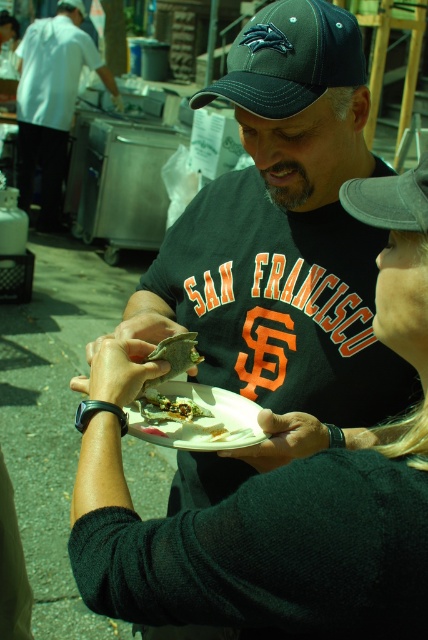
You are a food delivery robot that needs to place a shiny metallic food at center and a green matte leaf at center on a tray. The tray has a diameter of 10 inches. Can both items fit on the tray without overlapping?

The shiny metallic food at center is 4.41 inches away from the green matte leaf at center. Since the tray has a diameter of 10 inches, the minimum required distance between the two items is 4.41 inches, which is less than the tray size. Therefore, both items can fit on the tray without overlapping.

You are a food delivery robot that needs to place a new plate on the table. The table has limited space. Given the scene, can the new plate fit next to the existing matte black plate at center without overlapping the matte black shirt at center?

The matte black plate at center occupies less space than the matte black shirt at center. Since the shirt takes up more space, there might be enough room for the new plate next to the existing one without overlapping the shirt.